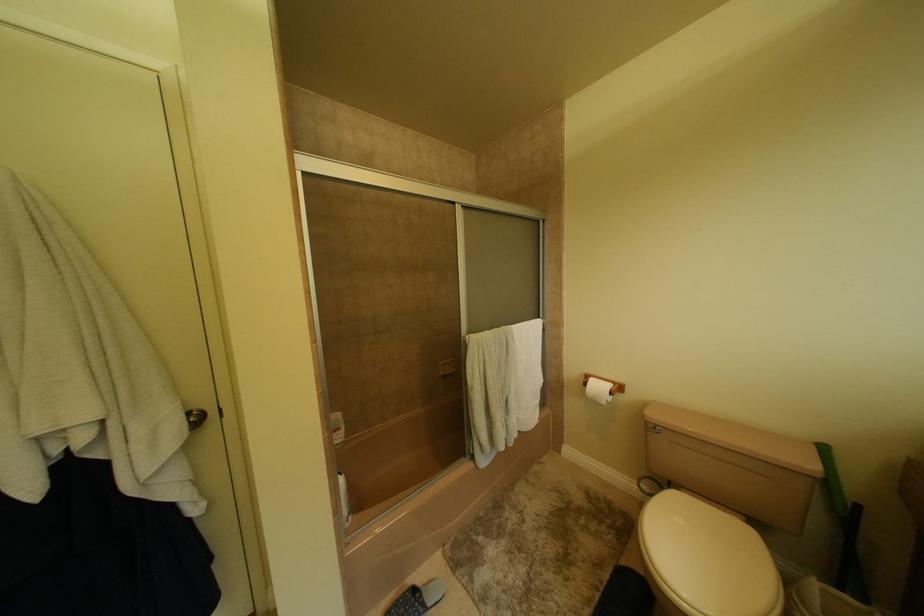
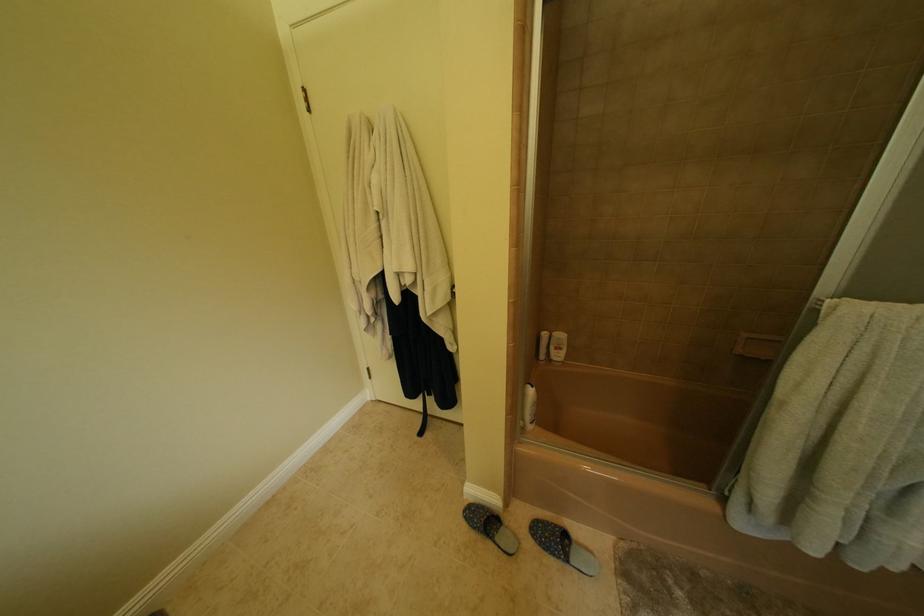
First-person continuous shooting, in which direction is the camera rotating?

The camera's rotation is toward left-down.